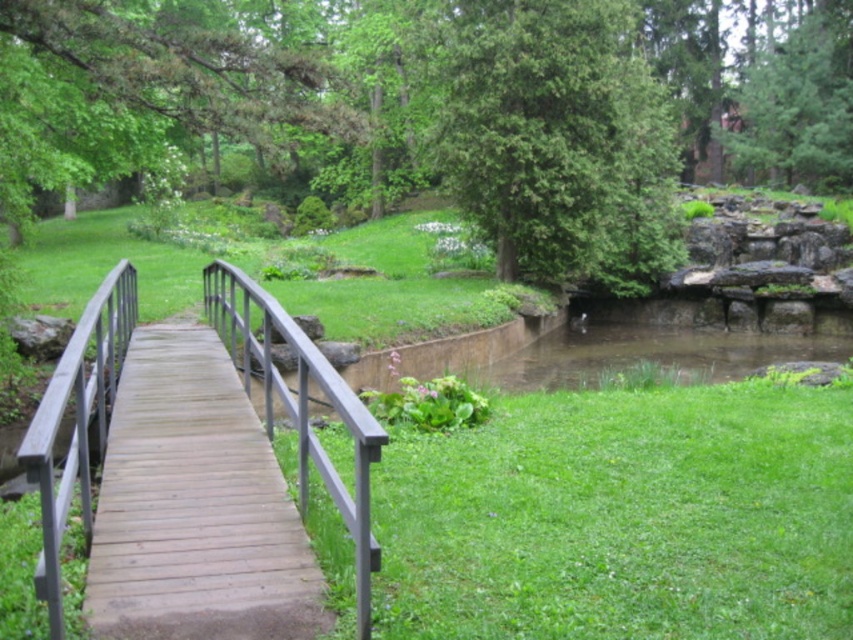
Locate an element on the screen. wooden bridge at center is located at coordinates (300, 406).

Is wooden bridge at center to the right of green textured tree at upper right from the viewer's perspective?

In fact, wooden bridge at center is to the left of green textured tree at upper right.

Who is more distant from viewer, (294, 404) or (786, 148)?

The point (786, 148) is more distant.

Identify the location of wooden bridge at center. The height and width of the screenshot is (640, 853). (300, 406).

Is point (601, 193) positioned in front of point (805, 77)?

Yes.

Does point (482, 12) come farther from viewer compared to point (833, 140)?

No, it is not.

Which is behind, point (463, 198) or point (843, 42)?

The point (843, 42) is behind.

Identify the location of green textured tree at upper center. The height and width of the screenshot is (640, 853). (556, 140).

Is wooden bridge at center smaller than brown wood rail at left?

Incorrect, wooden bridge at center is not smaller in size than brown wood rail at left.

Does point (241, 284) come farther from viewer compared to point (61, 404)?

Yes, point (241, 284) is behind point (61, 404).

Locate an element on the screen. wooden bridge at center is located at coordinates (300, 406).